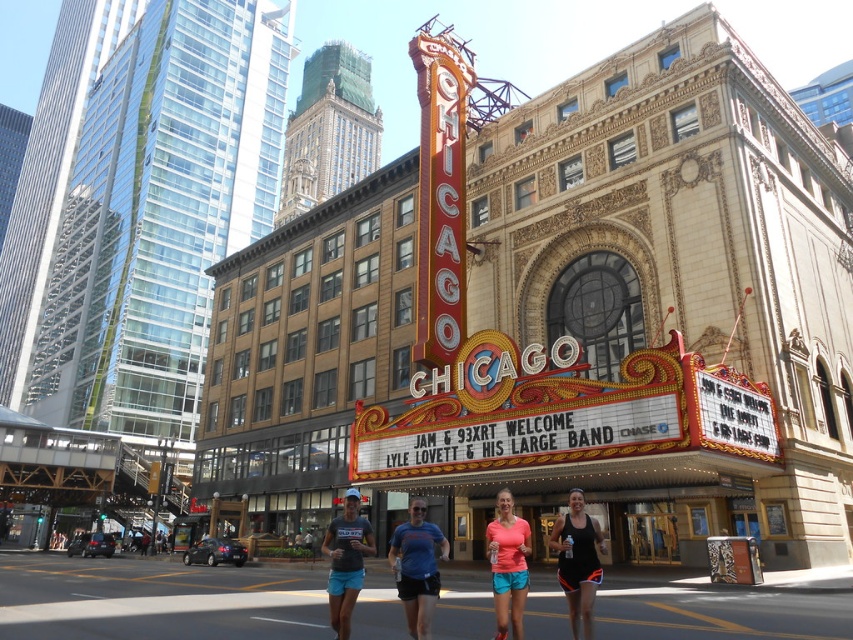
Is point (780, 195) positioned before point (347, 570)?

No.

Which is more to the right, gold ornate theater at center or dark gray matte t-shirt at center?

From the viewer's perspective, gold ornate theater at center appears more on the right side.

Who is more forward, (602, 209) or (366, 531)?

Positioned in front is point (366, 531).

Find the location of a particular element. gold ornate theater at center is located at coordinates (672, 288).

Who is positioned more to the left, blue fabric shirt at center or black matte tank top at center?

From the viewer's perspective, blue fabric shirt at center appears more on the left side.

Does blue fabric shirt at center have a greater height compared to black matte tank top at center?

Yes, blue fabric shirt at center is taller than black matte tank top at center.

The image size is (853, 640). In order to click on blue fabric shirt at center in this screenshot , I will do `click(416, 566)`.

Which is in front, point (672, 561) or point (415, 579)?

Positioned in front is point (415, 579).

Does gold ornate theater at center have a greater height compared to blue fabric shirt at center?

Yes.

Locate an element on the screen. gold ornate theater at center is located at coordinates (672, 288).